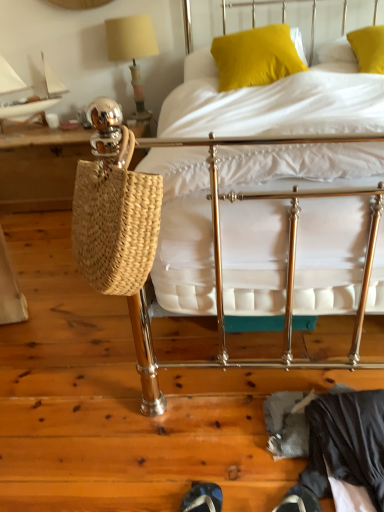
Question: Is dark gray fabric at lower right oriented away from yellow fabric pillow at upper center, positioned as the 1th pillow in left-to-right order?

Choices:
 (A) yes
 (B) no

Answer: (B)

Question: Considering the relative sizes of dark gray fabric at lower right and yellow fabric pillow at upper center, the 2th pillow in the right-to-left sequence, in the image provided, is dark gray fabric at lower right bigger than yellow fabric pillow at upper center, the 2th pillow in the right-to-left sequence,?

Choices:
 (A) no
 (B) yes

Answer: (A)

Question: Can you confirm if dark gray fabric at lower right is smaller than yellow fabric pillow at upper center, positioned as the 1th pillow in left-to-right order?

Choices:
 (A) no
 (B) yes

Answer: (B)

Question: Is dark gray fabric at lower right further to camera compared to yellow fabric pillow at upper center, the 2th pillow in the right-to-left sequence?

Choices:
 (A) no
 (B) yes

Answer: (A)

Question: Can you confirm if dark gray fabric at lower right is shorter than yellow fabric pillow at upper center, positioned as the 1th pillow in left-to-right order?

Choices:
 (A) yes
 (B) no

Answer: (A)

Question: Considering the positions of metallic gold bed at center and dark gray fabric at lower right in the image, is metallic gold bed at center wider or thinner than dark gray fabric at lower right?

Choices:
 (A) wide
 (B) thin

Answer: (A)

Question: Choose the correct answer: Is metallic gold bed at center inside dark gray fabric at lower right or outside it?

Choices:
 (A) outside
 (B) inside

Answer: (A)

Question: From the image's perspective, is metallic gold bed at center above or below dark gray fabric at lower right?

Choices:
 (A) below
 (B) above

Answer: (B)

Question: Based on their sizes in the image, would you say metallic gold bed at center is bigger or smaller than dark gray fabric at lower right?

Choices:
 (A) big
 (B) small

Answer: (A)

Question: Is metallic gold bed at center inside the boundaries of yellow fabric pillow at upper center, the 2th pillow in the right-to-left sequence, or outside?

Choices:
 (A) inside
 (B) outside

Answer: (B)

Question: From their relative heights in the image, would you say metallic gold bed at center is taller or shorter than yellow fabric pillow at upper center, positioned as the 1th pillow in left-to-right order?

Choices:
 (A) short
 (B) tall

Answer: (B)

Question: Looking at their shapes, would you say metallic gold bed at center is wider or thinner than yellow fabric pillow at upper center, positioned as the 1th pillow in left-to-right order?

Choices:
 (A) thin
 (B) wide

Answer: (B)

Question: From a real-world perspective, is metallic gold bed at center physically located above or below yellow fabric pillow at upper center, positioned as the 1th pillow in left-to-right order?

Choices:
 (A) above
 (B) below

Answer: (B)

Question: From their relative heights in the image, would you say yellow fabric pillow at upper center, positioned as the 1th pillow in left-to-right order, is taller or shorter than woven straw bag at left?

Choices:
 (A) tall
 (B) short

Answer: (B)

Question: In the image, is yellow fabric pillow at upper center, the 2th pillow in the right-to-left sequence, positioned in front of or behind woven straw bag at left?

Choices:
 (A) front
 (B) behind

Answer: (A)